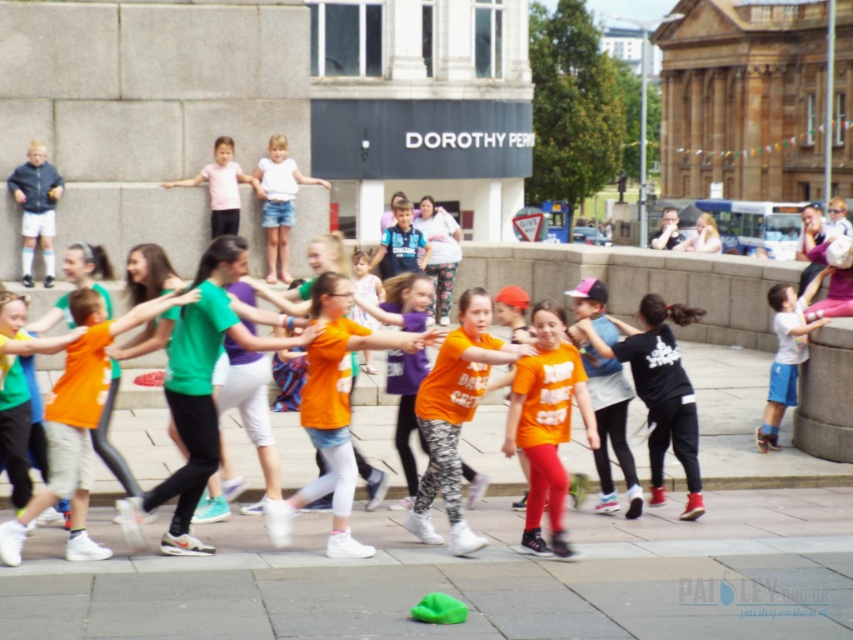
You are a photographer trying to capture a clear shot of the white cotton shirt at center. However, the green fabric at lower center is blocking your view. Can you move to the left or right to avoid the obstruction?

The green fabric at lower center is in front of the white cotton shirt at center, so moving to the left or right might allow you to see around the obstruction. However, the exact direction depends on the spatial arrangement of the subjects.

You are a photographer standing at the edge of the plaza. You want to take a photo that includes both the green fabric at lower center and the orange cotton shirt at center. The minimum distance between these two objects for the photo to fit in your camera frame is 6 feet. Will the current distance allow you to capture both in one shot?

The distance between the green fabric at lower center and the orange cotton shirt at center is 6.40 feet, which exceeds the minimum required 6 feet. Therefore, the photographer can capture both objects in one shot as the distance is sufficient.

You are a photographer trying to capture the orange cotton shirt at center and the pink fabric shirt at upper center in the same frame. Which shirt should you focus on first to ensure both are in focus?

You should focus on the orange cotton shirt at center first because it is closer to the viewer than the pink fabric shirt at upper center, so adjusting focus from near to far will help both shirts be in focus.